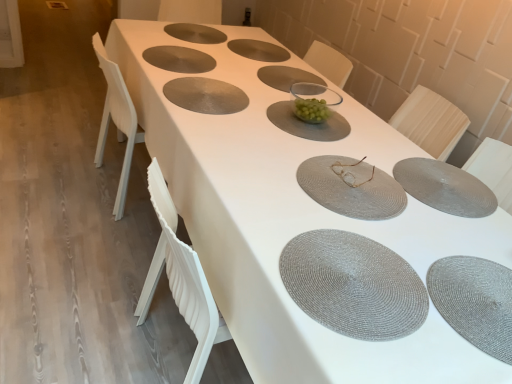
Where is `free space underneath gray woven placemat at lower right, acting as the 9th tableware starting from the top (from a real-world perspective)`? Image resolution: width=512 pixels, height=384 pixels. free space underneath gray woven placemat at lower right, acting as the 9th tableware starting from the top (from a real-world perspective) is located at coordinates (478, 295).